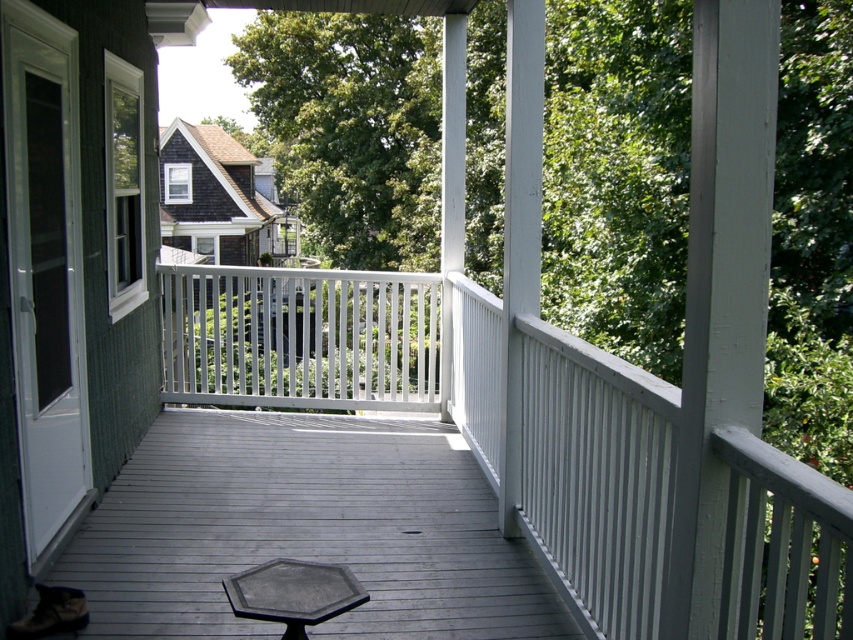
You are sitting on the white plastic chair at center and want to step onto the gray wood deck at center. Which direction should you move to reach the deck?

The gray wood deck at center is positioned on the right side of the white plastic chair at center, so you should move to your right to reach the deck.

You are a delivery person trying to place a package on the porch. The package is 1.2 meters tall. There are two objects in the way. The white painted wood balustrade at center and the white plastic chair at center. Which object is shorter and can you place the package on top of it?

The white painted wood balustrade at center is shorter than the white plastic chair at center. Since the package is 1.2 meters tall, it might not fit on top of either object if their heights are below this measurement. However, the balustrade being shorter means it is less likely to accommodate the package compared to the chair. To determine feasibility, the actual heights of both objects would be needed.

You are moving a 3.0 meter long ladder from the garage to the backyard. You need to pass through the porch area. The ladder is too long to carry vertically, so you have to carry it horizontally. Is there enough space between the gray wood deck at center and the white plastic chair at center to move the ladder horizontally through the porch?

The distance between the gray wood deck at center and the white plastic chair at center is 2.84 meters. Since the ladder is 3.0 meters long, which is longer than the available space, there isn not enough room to move the ladder horizontally between them.